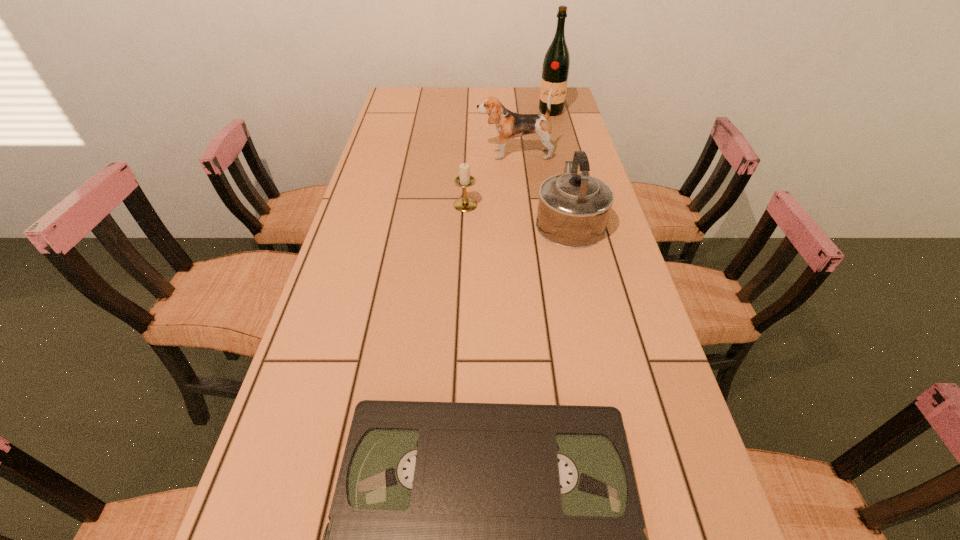
Where is `vacant space located 0.210m with the spout at the front of the kettle`? The width and height of the screenshot is (960, 540). vacant space located 0.210m with the spout at the front of the kettle is located at coordinates (555, 157).

Image resolution: width=960 pixels, height=540 pixels. In order to click on free spot located with the spout at the front of the kettle in this screenshot , I will do `click(549, 136)`.

Identify the location of vacant space located on the back of the second shortest object. (468, 141).

Image resolution: width=960 pixels, height=540 pixels. I want to click on object located at the far edge, so click(x=556, y=64).

Locate an element on the screen. The image size is (960, 540). liquor at the right edge is located at coordinates (556, 64).

Image resolution: width=960 pixels, height=540 pixels. Find the location of `puppy at the right edge`. puppy at the right edge is located at coordinates (509, 125).

The image size is (960, 540). Identify the location of kettle at the right edge. [573, 211].

Find the location of a particular element. The width and height of the screenshot is (960, 540). object positioned at the far right corner is located at coordinates (556, 64).

This screenshot has height=540, width=960. Find the location of `blank space at the far edge of the desktop`. blank space at the far edge of the desktop is located at coordinates (445, 92).

This screenshot has width=960, height=540. In order to click on free space at the left edge of the desktop in this screenshot , I will do `click(419, 124)`.